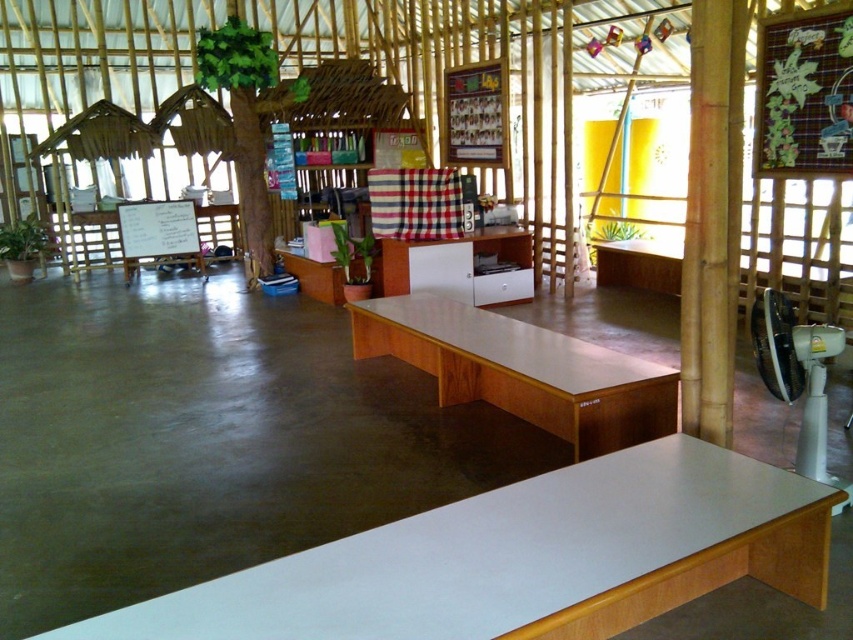
Consider the image. You are a teacher preparing for a class and need to place a 1.2 meter tall projector on one of the white glossy table at lower center or the white glossy cabinet at center. Which object can accommodate the projector without it exceeding the height limit?

The white glossy cabinet at center is taller than the white glossy table at lower center. Since the projector is 1.2 meters tall, the white glossy cabinet at center can accommodate it without exceeding the height limit.

You are organizing a small event in this tropical bamboo hall and need to place a large centerpiece on the table. Which table, the white glossy table at lower center or the light brown wood table at center, would be more suitable for placing a large centerpiece?

The light brown wood table at center is more suitable for placing a large centerpiece because it occupies more space than the white glossy table at lower center.